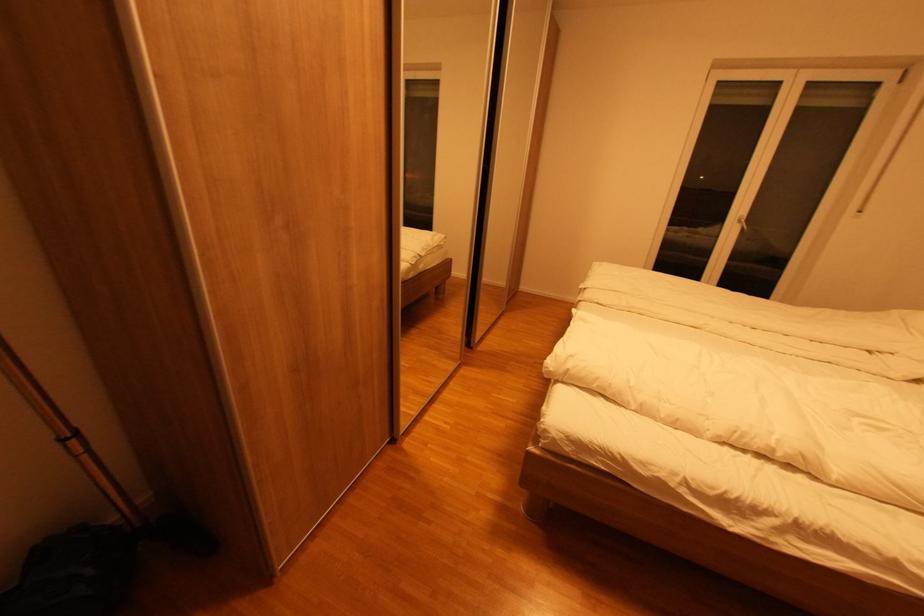
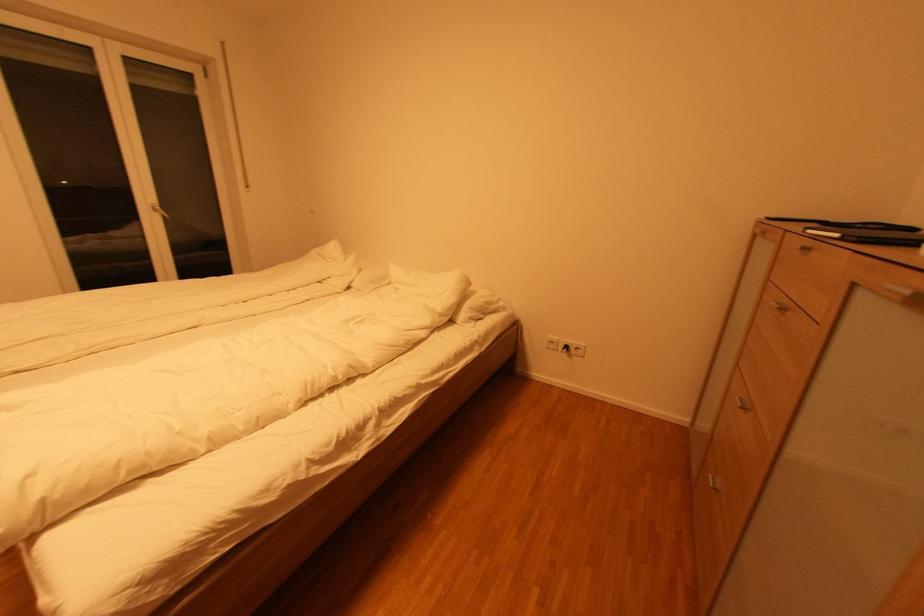
The first image is from the beginning of the video and the second image is from the end. How did the camera likely rotate when shooting the video?

The camera's rotation is toward right-down.